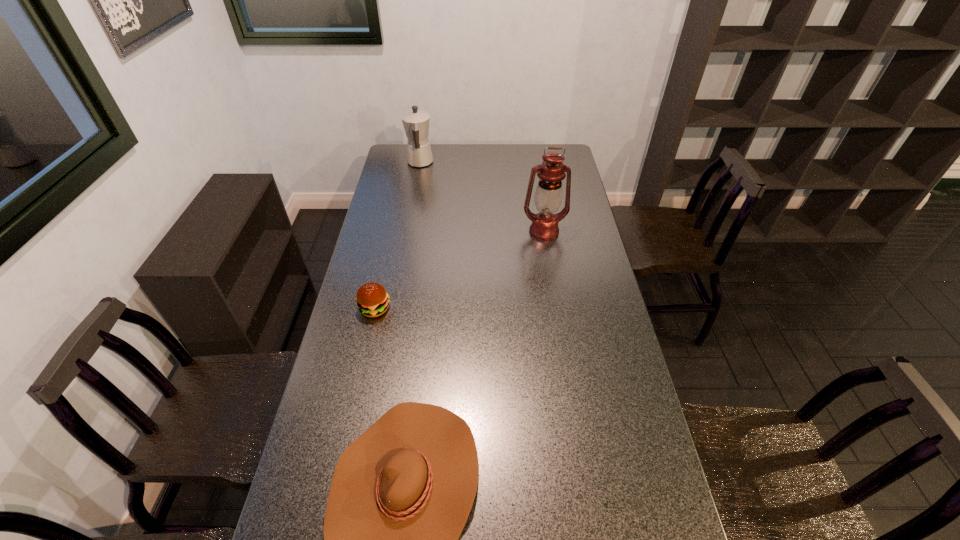
Locate an element on the screen. The height and width of the screenshot is (540, 960). oil lamp is located at coordinates (548, 196).

Identify the location of the second farthest object. pyautogui.click(x=548, y=196).

The height and width of the screenshot is (540, 960). Find the location of `the farthest object`. the farthest object is located at coordinates (416, 122).

Locate an element on the screen. Image resolution: width=960 pixels, height=540 pixels. the third shortest object is located at coordinates (416, 122).

Find the location of a particular element. The image size is (960, 540). the third farthest object is located at coordinates (372, 299).

Where is `the third tallest object`? The width and height of the screenshot is (960, 540). the third tallest object is located at coordinates (372, 299).

Locate an element on the screen. vacant position located 0.220m on the front of the second farthest object is located at coordinates (552, 280).

Find the location of a particular element. vacant space situated on the right of the second tallest object is located at coordinates (449, 163).

The width and height of the screenshot is (960, 540). What are the coordinates of `vacant space situated on the front of the hamburger` in the screenshot? It's located at (370, 333).

Find the location of a particular element. This screenshot has width=960, height=540. object present at the far edge is located at coordinates (416, 122).